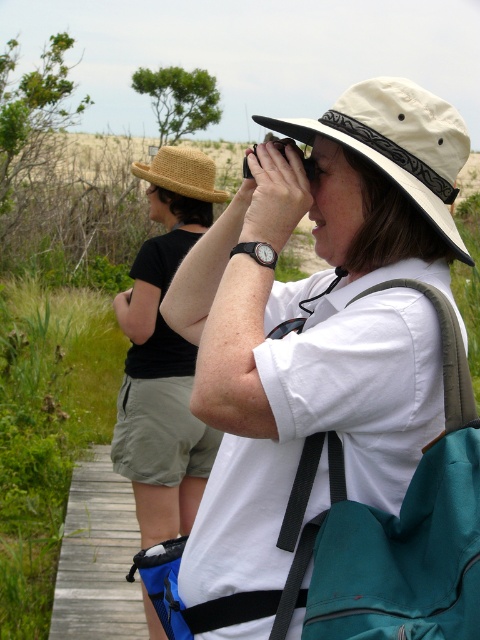
Locate an element on the screen. The height and width of the screenshot is (640, 480). white cotton shirt at center is located at coordinates (319, 321).

Is point (412, 244) more distant than point (192, 170)?

No, (412, 244) is in front of (192, 170).

Which is behind, point (360, 452) or point (203, 176)?

Positioned behind is point (203, 176).

The width and height of the screenshot is (480, 640). I want to click on white cotton shirt at center, so click(319, 321).

Does white cotton shirt at center have a lesser height compared to teal fabric backpack at center?

No.

Is white cotton shirt at center below teal fabric backpack at center?

No.

Measure the distance between white cotton shirt at center and camera.

white cotton shirt at center and camera are 3.91 feet apart from each other.

Identify the location of white cotton shirt at center. The width and height of the screenshot is (480, 640). (319, 321).

Is straw hat at left smaller than beige fabric hat at center?

No.

Which is above, straw hat at left or beige fabric hat at center?

beige fabric hat at center is higher up.

Who is more distant from viewer, [127,444] or [359,122]?

Positioned behind is point [127,444].

Identify the location of straw hat at left. Image resolution: width=480 pixels, height=640 pixels. (164, 355).